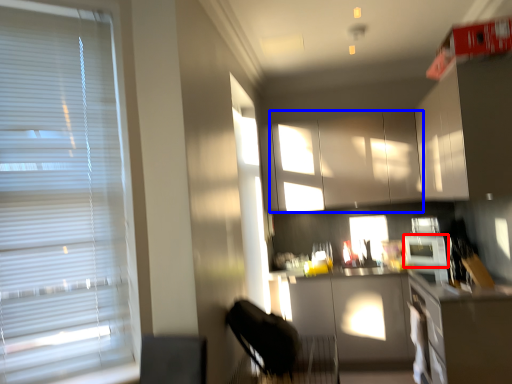
Question: Which of the following is the farthest to the observer, appliance (highlighted by a red box) or cabinetry (highlighted by a blue box)?

Choices:
 (A) appliance
 (B) cabinetry

Answer: (B)